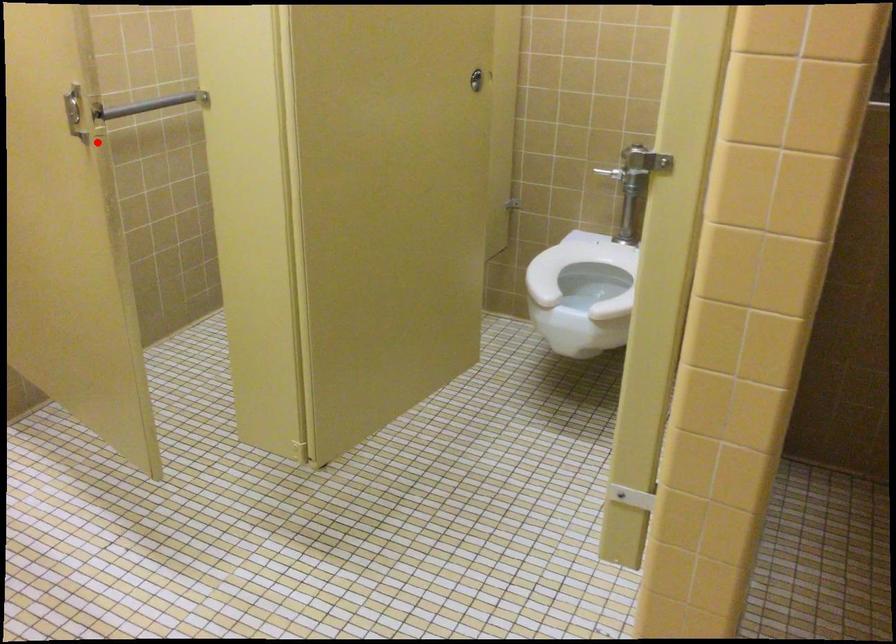
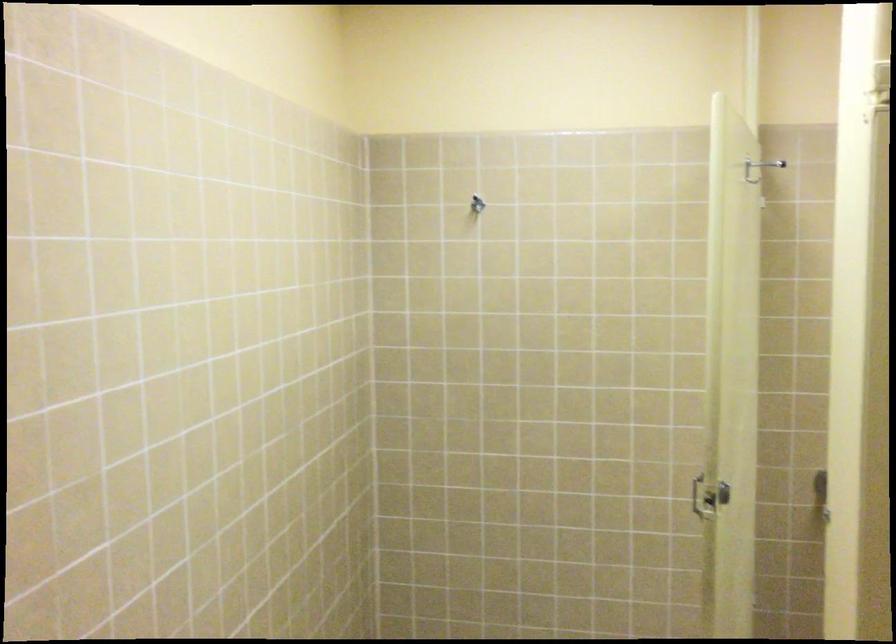
Question: I am providing you with two images of the same scene from different viewpoints. In image1, a red point is highlighted. Considering the same 3D point in image2, which of the following is correct?

Choices:
 (A) It is closer
 (B) It is farther

Answer: (B)